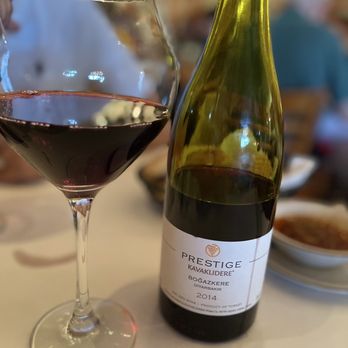
Identify the location of bottle of wine. (245, 163).